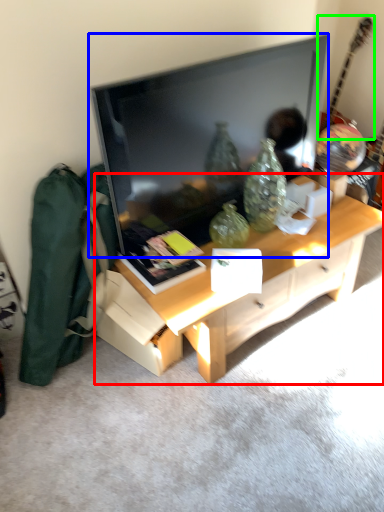
Question: Considering the real-world distances, which object is closest to desk (highlighted by a red box)? television (highlighted by a blue box) or guitar (highlighted by a green box).

Choices:
 (A) television
 (B) guitar

Answer: (A)